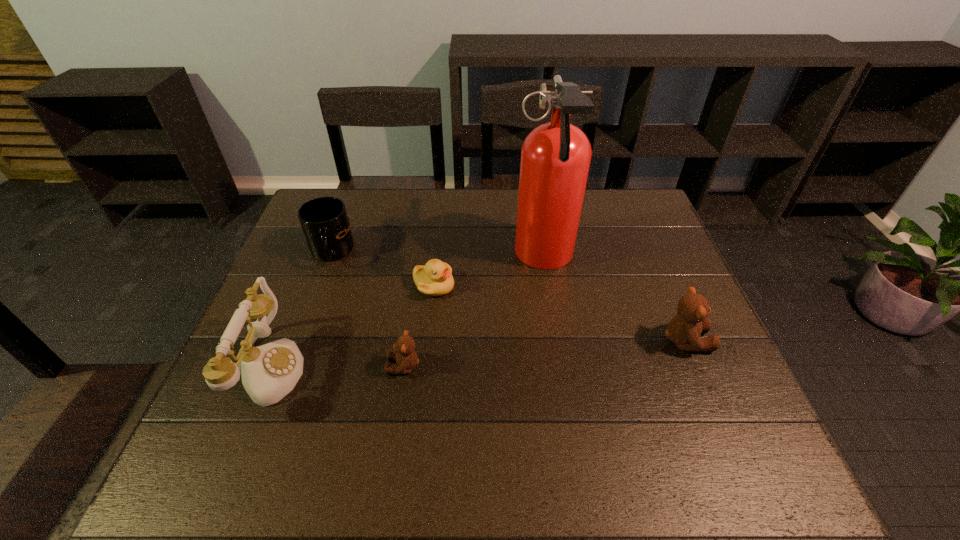
Locate an element on the screen. The width and height of the screenshot is (960, 540). object located at the near left corner is located at coordinates (269, 372).

In the image, there is a desktop. At what (x,y) coordinates should I click in order to perform the action: click on vacant space at the far edge. Please return your answer as a coordinate pair (x, y). This screenshot has height=540, width=960. Looking at the image, I should click on (503, 195).

Find the location of `vacant area at the near edge`. vacant area at the near edge is located at coordinates (624, 417).

At what (x,y) coordinates should I click in order to perform the action: click on vacant space at the right edge of the desktop. Please return your answer as a coordinate pair (x, y). Looking at the image, I should click on (653, 235).

Image resolution: width=960 pixels, height=540 pixels. In the image, there is a desktop. In order to click on vacant space at the far left corner in this screenshot , I will do `click(347, 201)`.

At what (x,y) coordinates should I click in order to perform the action: click on vacant space at the far right corner of the desktop. Please return your answer as a coordinate pair (x, y). Looking at the image, I should click on (626, 200).

At what (x,y) coordinates should I click in order to perform the action: click on vacant area that lies between the fire extinguisher and the shorter teddy bear. Please return your answer as a coordinate pair (x, y). Looking at the image, I should click on (473, 312).

This screenshot has height=540, width=960. What are the coordinates of `free point between the left teddy bear and the right teddy bear` in the screenshot? It's located at (544, 353).

This screenshot has height=540, width=960. Find the location of `empty space between the fifth object from left to right and the right teddy bear`. empty space between the fifth object from left to right and the right teddy bear is located at coordinates (614, 299).

The height and width of the screenshot is (540, 960). I want to click on vacant area between the mug and the duckling, so click(x=383, y=269).